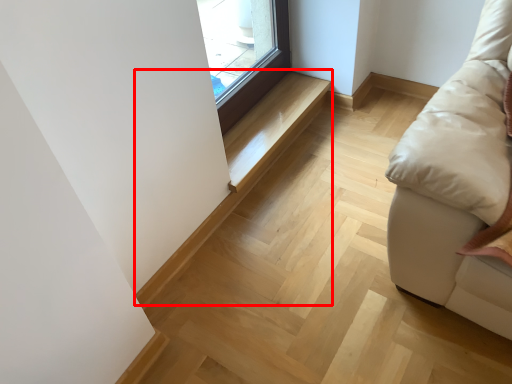
Question: From the image, what is the correct spatial relationship of stairwell (annotated by the red box) in relation to stairwell?

Choices:
 (A) left
 (B) right

Answer: (A)